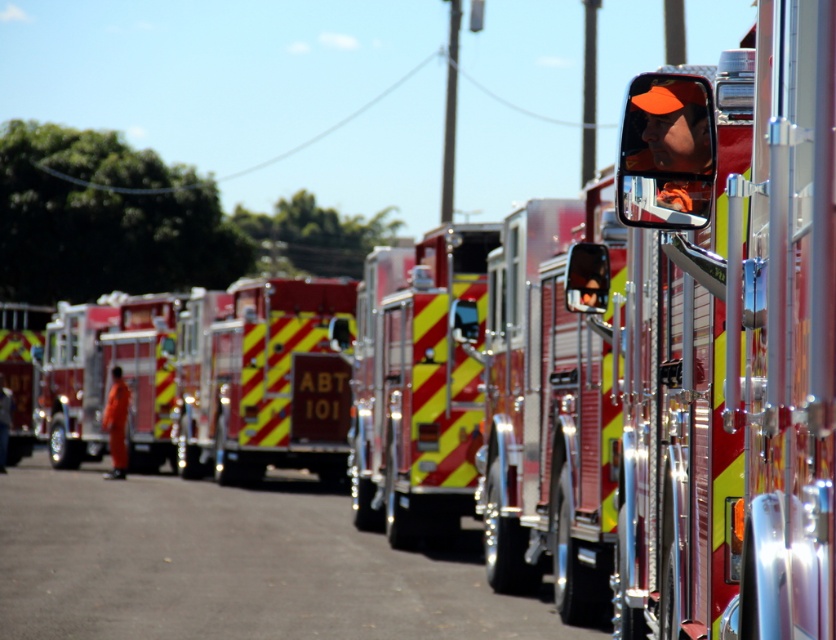
You are a delivery person trying to park your van between the metallic red fire truck at left and the orange fabric fireman at center. Can you fit your 2.5 meter wide van in the space between them?

The metallic red fire truck at left is wider than the orange fabric fireman at center. However, the exact distance between them isn not specified in the Objects Description. Without knowing the space between them, it is impossible to determine if the van will fit.

You are a firefighter checking the parking space. The fire truck needs to fit into a space that is exactly the same width as the orange reflective mirror at center. Can the yellow reflective fire truck at center fit into this space?

The yellow reflective fire truck at center is wider than the orange reflective mirror at center, so it cannot fit into a space that matches the mirror width.